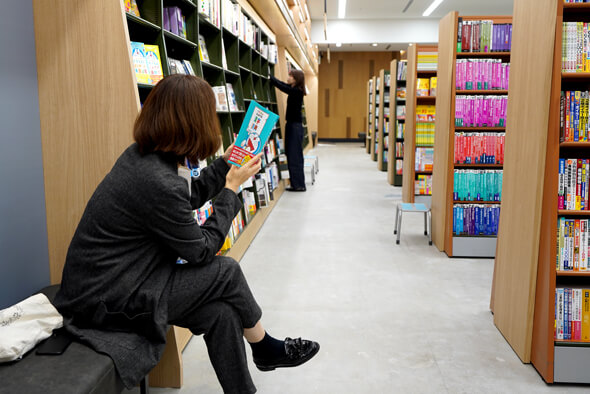
In order to click on bookshelves in this screenshot , I will do `click(520, 219)`, `click(450, 130)`, `click(409, 137)`, `click(389, 135)`, `click(379, 122)`, `click(360, 117)`, `click(70, 120)`, `click(319, 113)`.